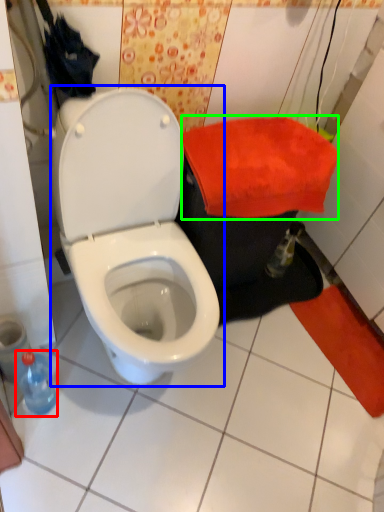
Question: Which object is positioned closest to bottle (highlighted by a red box)? Select from toilet (highlighted by a blue box) and beach towel (highlighted by a green box).

Choices:
 (A) toilet
 (B) beach towel

Answer: (A)